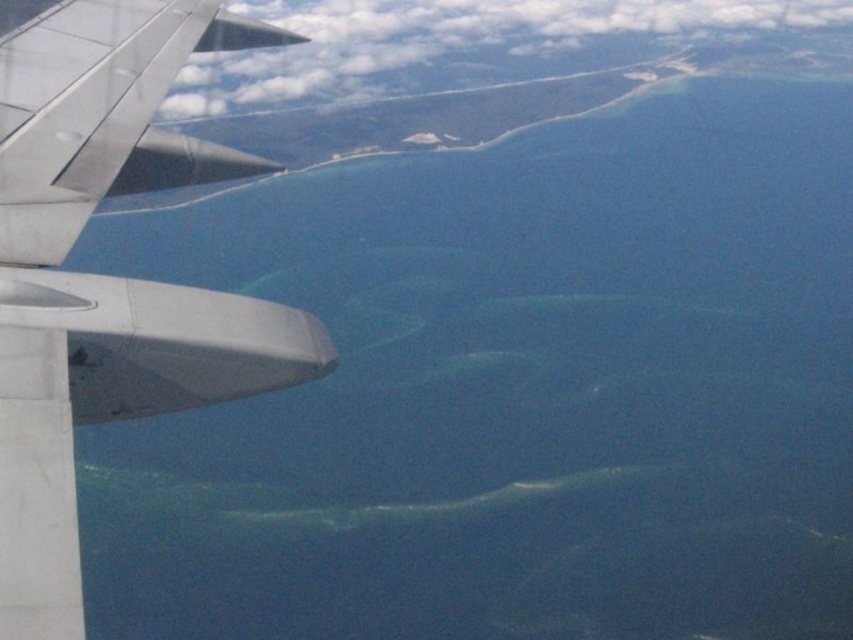
You are sitting in an airplane seat and looking out the window. There is a point marked at coordinates point (126, 115). If you want to reach that point with your hand, can you do it while keeping your seatbelt fastened?

The point (126, 115) is 22.10 feet from viewer, so no, you cannot reach it with your hand while keeping your seatbelt fastened because it is too far away.

You are a passenger sitting by the window and see the metallic gray wing at left and the white fluffy cloud at upper center. Which object is closer to you?

The metallic gray wing at left is closer to you because it is positioned below the white fluffy cloud at upper center, indicating it is in the foreground of the scene.